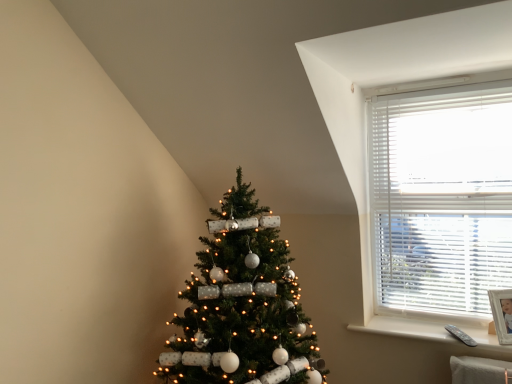
Locate an element on the screen. This screenshot has height=384, width=512. empty space that is ontop of white plastic remote at lower right (from a real-world perspective) is located at coordinates (431, 329).